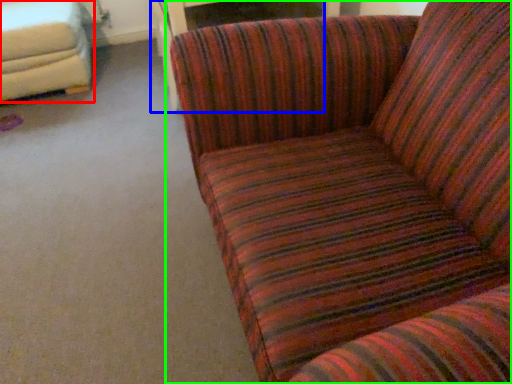
Question: Estimate the real-world distances between objects in this image. Which object is farther from studio couch (highlighted by a red box), table (highlighted by a blue box) or studio couch (highlighted by a green box)?

Choices:
 (A) table
 (B) studio couch

Answer: (B)